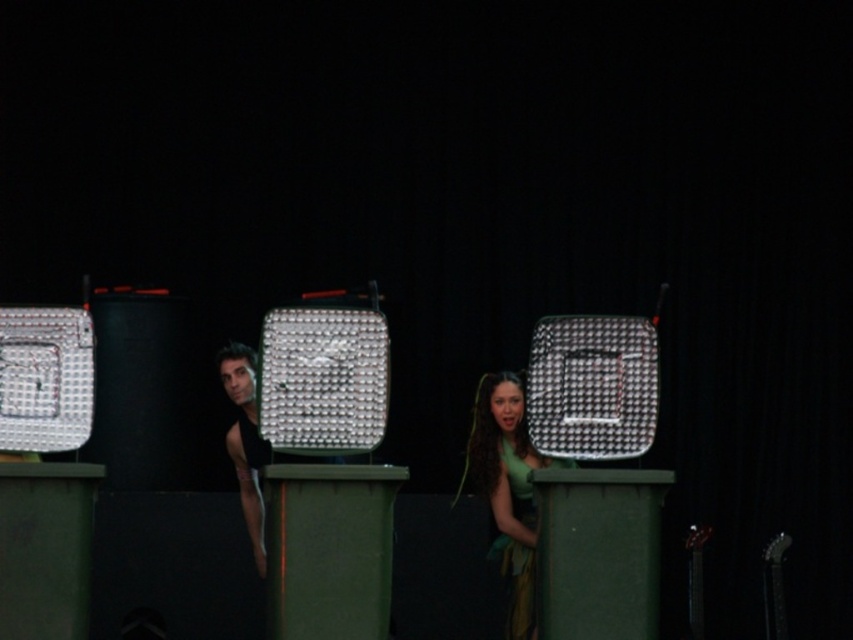
Does green matte dress at center appear over black matte tank top at center?

No.

Is green matte dress at center further to the viewer compared to black matte tank top at center?

No, it is in front of black matte tank top at center.

The height and width of the screenshot is (640, 853). I want to click on green matte dress at center, so click(x=508, y=488).

Locate an element on the screen. Image resolution: width=853 pixels, height=640 pixels. green matte dress at center is located at coordinates (508, 488).